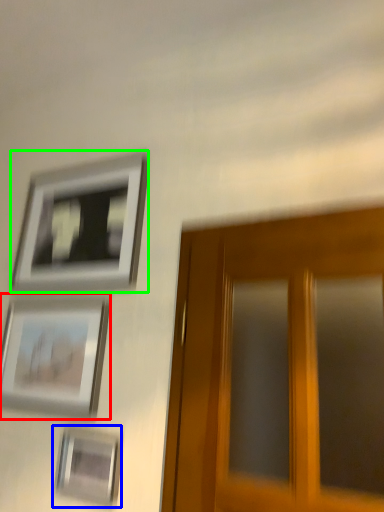
Question: Which object is positioned farthest from picture frame (highlighted by a red box)? Select from picture frame (highlighted by a blue box) and picture frame (highlighted by a green box).

Choices:
 (A) picture frame
 (B) picture frame

Answer: (B)